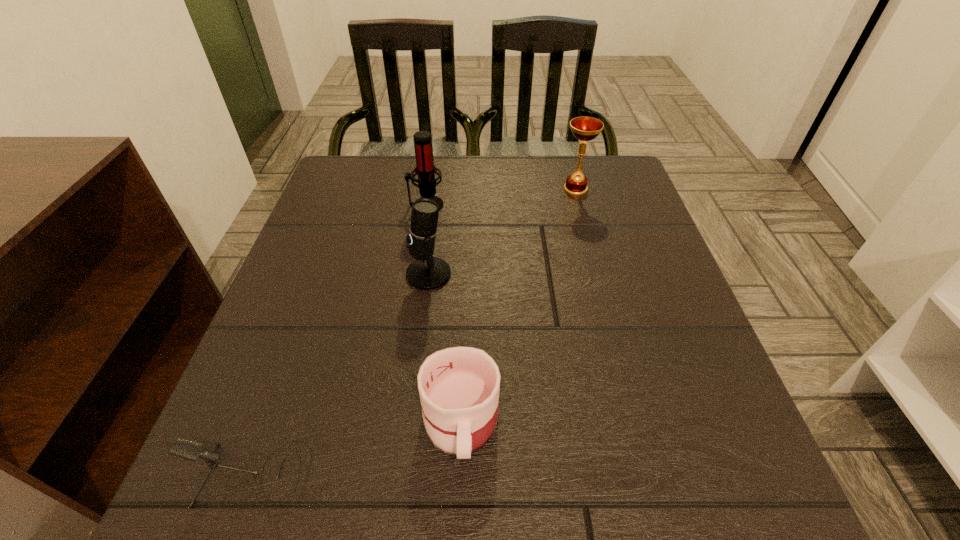
Find the location of a particular element. The height and width of the screenshot is (540, 960). free spot at the left edge of the desktop is located at coordinates (353, 258).

In order to click on free space at the right edge in this screenshot , I will do (680, 404).

Where is `vacant space at the far left corner`? The height and width of the screenshot is (540, 960). vacant space at the far left corner is located at coordinates (348, 183).

Locate an element on the screen. The image size is (960, 540). vacant space at the near left corner is located at coordinates (182, 518).

Where is `vacant space at the far right corner`? This screenshot has height=540, width=960. vacant space at the far right corner is located at coordinates (625, 161).

Where is `unoccupied area between the nearest microphone and the farthest microphone`? unoccupied area between the nearest microphone and the farthest microphone is located at coordinates (340, 341).

Identify the location of vacant area that lies between the farthest microphone and the leftmost microphone. (340, 341).

The image size is (960, 540). What are the coordinates of `free space between the second farthest microphone and the rightmost object` in the screenshot? It's located at (502, 232).

Image resolution: width=960 pixels, height=540 pixels. I want to click on unoccupied area between the farthest microphone and the mug, so click(x=444, y=312).

What are the coordinates of `free space that is in between the nearest microphone and the farthest microphone` in the screenshot? It's located at (340, 341).